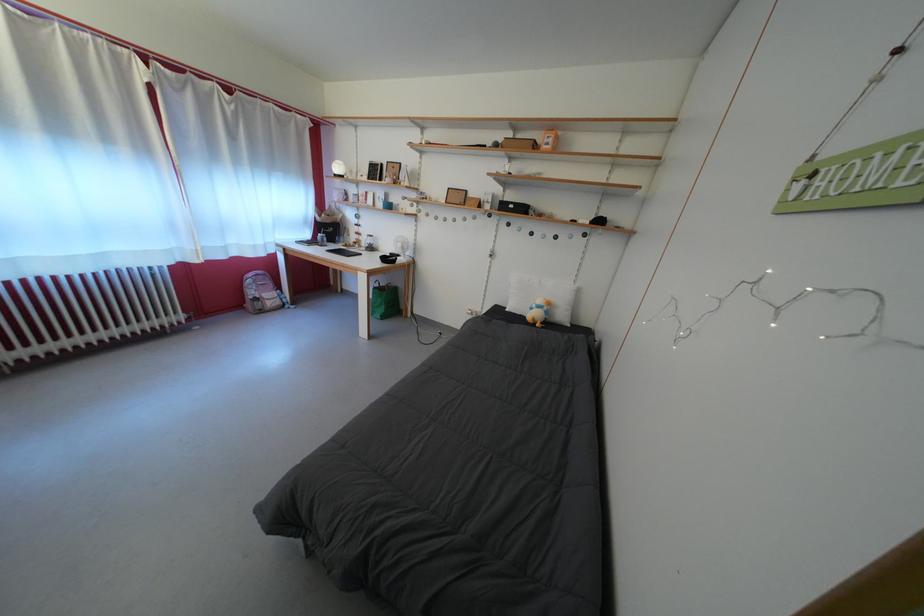
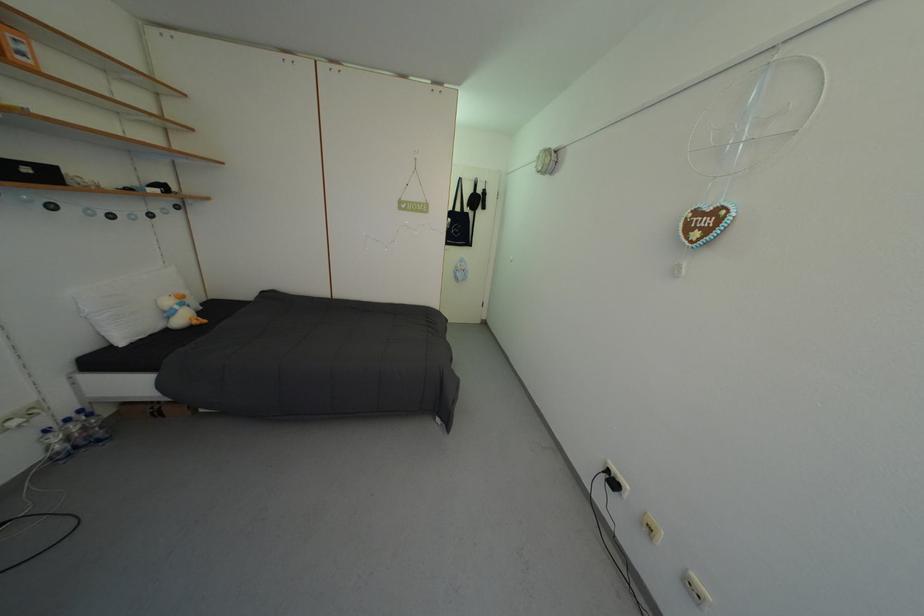
The point at (x=555, y=150) is marked in the first image. Where is the corresponding point in the second image?

(30, 60)